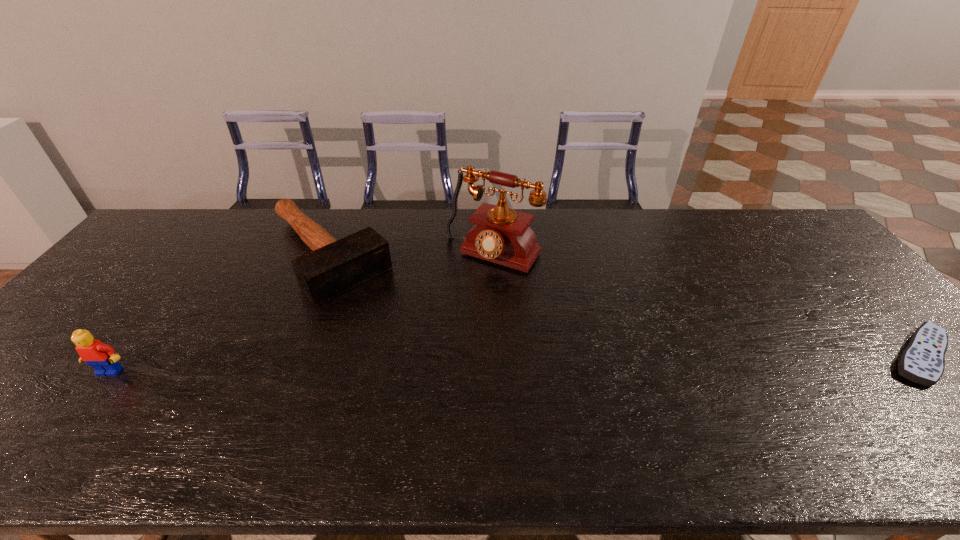
You are a GUI agent. You are given a task and a screenshot of the screen. Output one action in this format:
    pyautogui.click(x=<x>, y=<y>)
    Task: Click on the free space between the third object from right to left and the Lego
    This screenshot has height=540, width=960.
    Given the screenshot: What is the action you would take?
    pyautogui.click(x=219, y=314)

You are a GUI agent. You are given a task and a screenshot of the screen. Output one action in this format:
    pyautogui.click(x=<x>, y=<y>)
    Task: Click on the free space between the third object from left to right and the second object from left to right
    The image size is (960, 540).
    Given the screenshot: What is the action you would take?
    pyautogui.click(x=410, y=255)

This screenshot has height=540, width=960. I want to click on free space between the Lego and the telephone, so click(x=301, y=313).

You are a GUI agent. You are given a task and a screenshot of the screen. Output one action in this format:
    pyautogui.click(x=<x>, y=<y>)
    Task: Click on the vacant area that lies between the second object from left to right and the third shortest object
    Image resolution: width=960 pixels, height=540 pixels.
    Given the screenshot: What is the action you would take?
    pyautogui.click(x=219, y=314)

Where is `object that is the third closest to the third object from right to left`? The image size is (960, 540). object that is the third closest to the third object from right to left is located at coordinates (923, 361).

Locate an element on the screen. This screenshot has width=960, height=540. object that is the second closest to the second shortest object is located at coordinates (101, 357).

What are the coordinates of `vacant area that satisfies the following two spatial constraints: 1. on the back side of the tallest object; 2. on the right side of the second shortest object` in the screenshot? It's located at (328, 254).